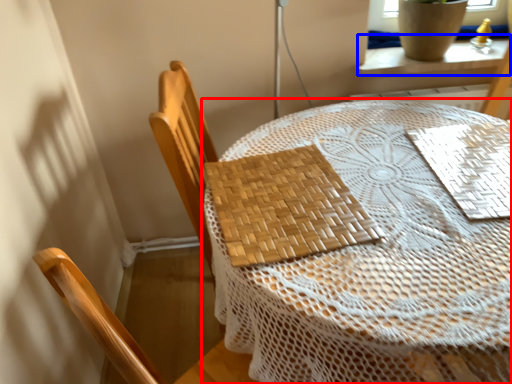
Question: Which point is closer to the camera, table (highlighted by a red box) or window sill (highlighted by a blue box)?

Choices:
 (A) table
 (B) window sill

Answer: (A)